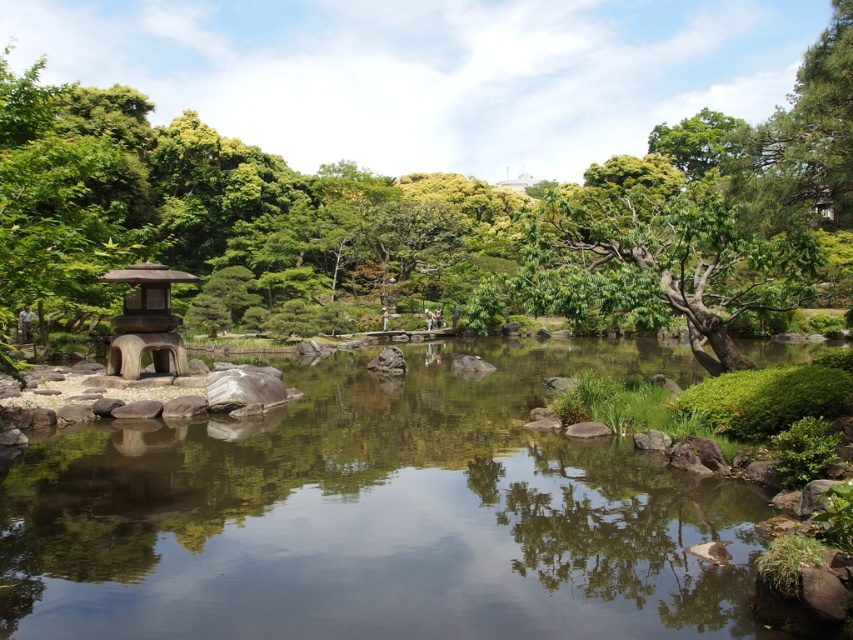
You are standing in the Japanese garden and want to cross the pond to reach the other side. There is a smooth stone stream at center marked by point (376, 515). Can you safely step on this stone to cross the pond?

The smooth stone stream at center is represented by point (376, 515), so yes, you can safely step on this stone to cross the pond.

You are a visitor in the Japanese garden and want to find the smooth bark tree at left. According to the garden map, it is located at point (427, 218). Can you confirm if this point is near the traditional Japanese lantern on the left side of the pond?

Yes, the smooth bark tree at left is located at point (427, 218), which is near the traditional Japanese lantern on the left side of the pond.